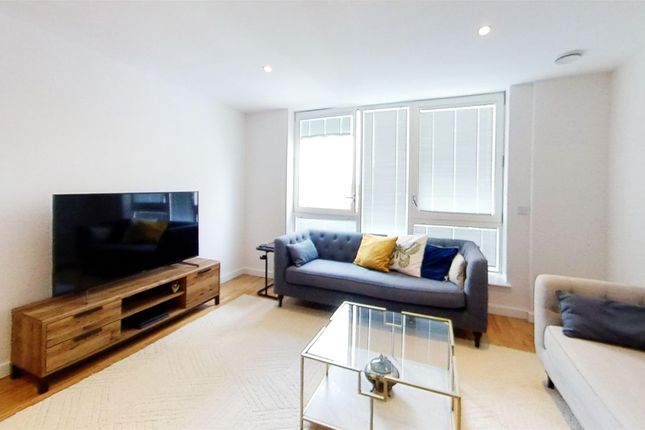
The width and height of the screenshot is (645, 430). In order to click on places to sit in this screenshot , I will do `click(611, 373)`, `click(333, 268)`.